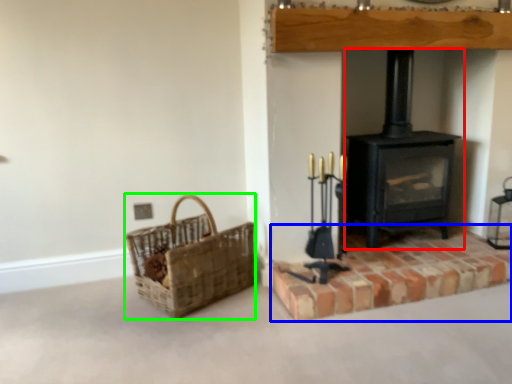
Question: Based on their relative distances, which object is nearer to wood burning stove (highlighted by a red box)? Choose from brickwork (highlighted by a blue box) and basket (highlighted by a green box).

Choices:
 (A) brickwork
 (B) basket

Answer: (A)